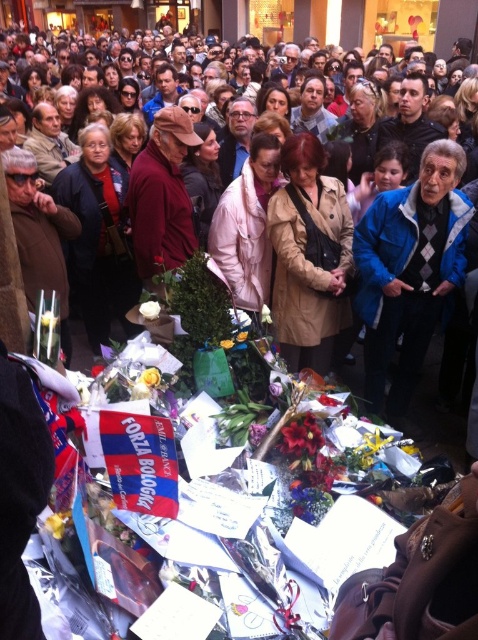
Question: Estimate the real-world distances between objects in this image. Which object is farther from the purple matte flower at lower center?

Choices:
 (A) blue jacket at center
 (B) tan leather coat at center
 (C) white matte flower at center
 (D) red silk flower at center

Answer: (A)

Question: Does white matte rose at center have a lesser width compared to purple matte flower at lower center?

Choices:
 (A) no
 (B) yes

Answer: (A)

Question: Which point is closer to the camera?

Choices:
 (A) yellow fabric flower at lower center
 (B) white matte flower at lower left
 (C) yellow paper flower at center
 (D) tan leather coat at center

Answer: (A)

Question: Does white matte rose at center appear on the right side of white matte flower at lower left?

Choices:
 (A) no
 (B) yes

Answer: (B)

Question: Does red silk flower at center have a larger size compared to white matte rose at center?

Choices:
 (A) no
 (B) yes

Answer: (B)

Question: Estimate the real-world distances between objects in this image. Which object is closer to the tan leather coat at center?

Choices:
 (A) yellow fabric flower at lower center
 (B) red silk flower at center
 (C) purple matte flower at lower center
 (D) white matte rose at center

Answer: (D)